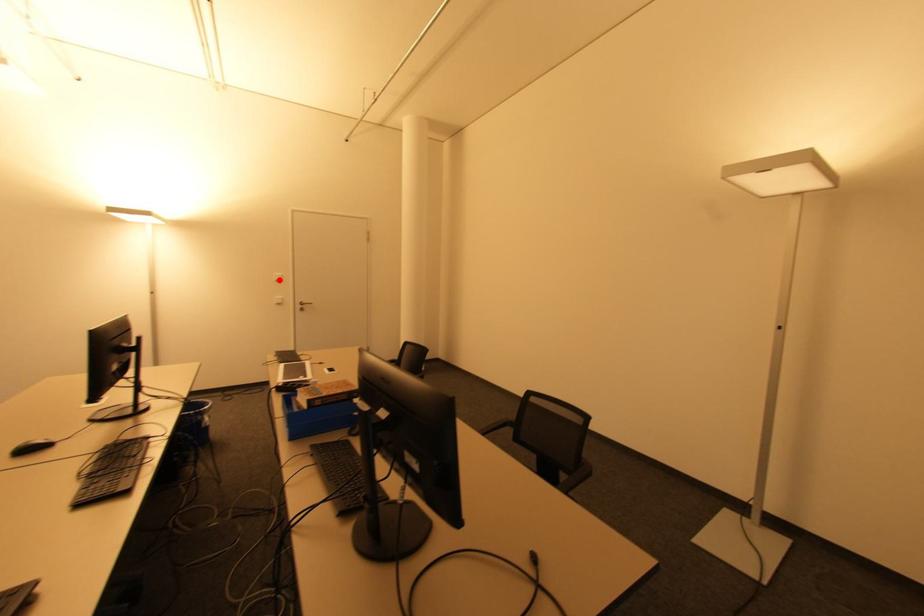
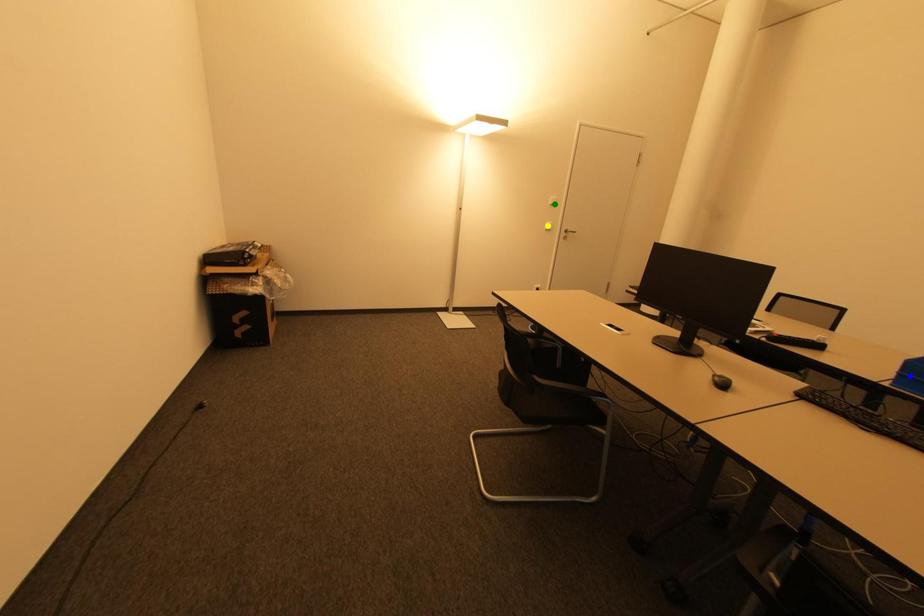
Question: I am providing you with two images of the same scene from different viewpoints. A red point is marked on the first image. You are given multiple points on the second image. Which mark in image 2 goes with the point in image 1?

Choices:
 (A) yellow point
 (B) blue point
 (C) green point

Answer: (C)